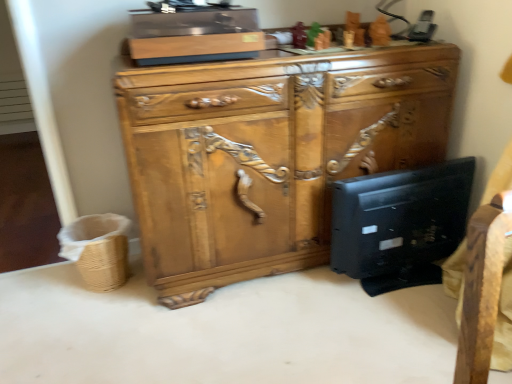
Question: Is black matte desktop computer at lower right smaller than woven brown basket at lower left?

Choices:
 (A) yes
 (B) no

Answer: (B)

Question: From a real-world perspective, is black matte desktop computer at lower right positioned under woven brown basket at lower left based on gravity?

Choices:
 (A) yes
 (B) no

Answer: (B)

Question: Is the position of black matte desktop computer at lower right more distant than that of woven brown basket at lower left?

Choices:
 (A) no
 (B) yes

Answer: (A)

Question: Is black matte desktop computer at lower right far from woven brown basket at lower left?

Choices:
 (A) no
 (B) yes

Answer: (B)

Question: Is woven brown basket at lower left a part of black matte desktop computer at lower right?

Choices:
 (A) yes
 (B) no

Answer: (B)

Question: From the image's perspective, does black matte desktop computer at lower right appear higher than woven brown basket at lower left?

Choices:
 (A) yes
 (B) no

Answer: (A)

Question: Can you confirm if wooden carved cabinet at center is positioned to the right of black matte desktop computer at lower right?

Choices:
 (A) no
 (B) yes

Answer: (A)

Question: Is wooden carved cabinet at center wider than black matte desktop computer at lower right?

Choices:
 (A) yes
 (B) no

Answer: (A)

Question: Is wooden carved cabinet at center located outside black matte desktop computer at lower right?

Choices:
 (A) yes
 (B) no

Answer: (A)

Question: Considering the relative sizes of wooden carved cabinet at center and black matte desktop computer at lower right in the image provided, is wooden carved cabinet at center smaller than black matte desktop computer at lower right?

Choices:
 (A) no
 (B) yes

Answer: (A)

Question: Is wooden carved cabinet at center shorter than black matte desktop computer at lower right?

Choices:
 (A) no
 (B) yes

Answer: (A)

Question: From the image's perspective, is wooden carved cabinet at center below black matte desktop computer at lower right?

Choices:
 (A) yes
 (B) no

Answer: (B)

Question: From a real-world perspective, is wooden carved cabinet at center positioned under woven brown basket at lower left based on gravity?

Choices:
 (A) no
 (B) yes

Answer: (A)